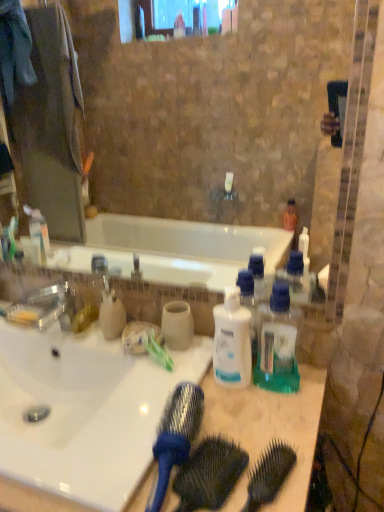
Locate an element on the screen. vacant area that lies to the right of blue plastic brush at center, which appears as the 1th brush when viewed from the left is located at coordinates tap(262, 435).